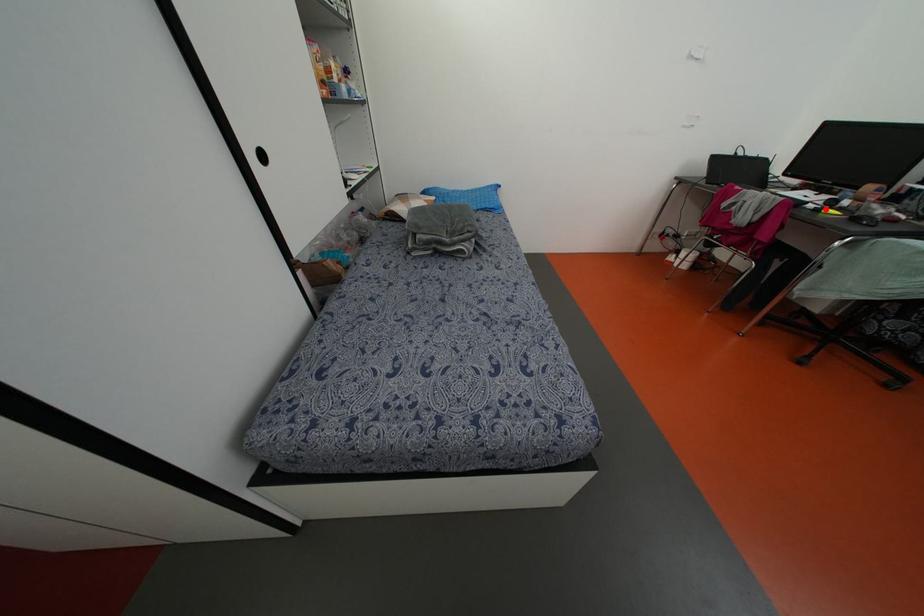
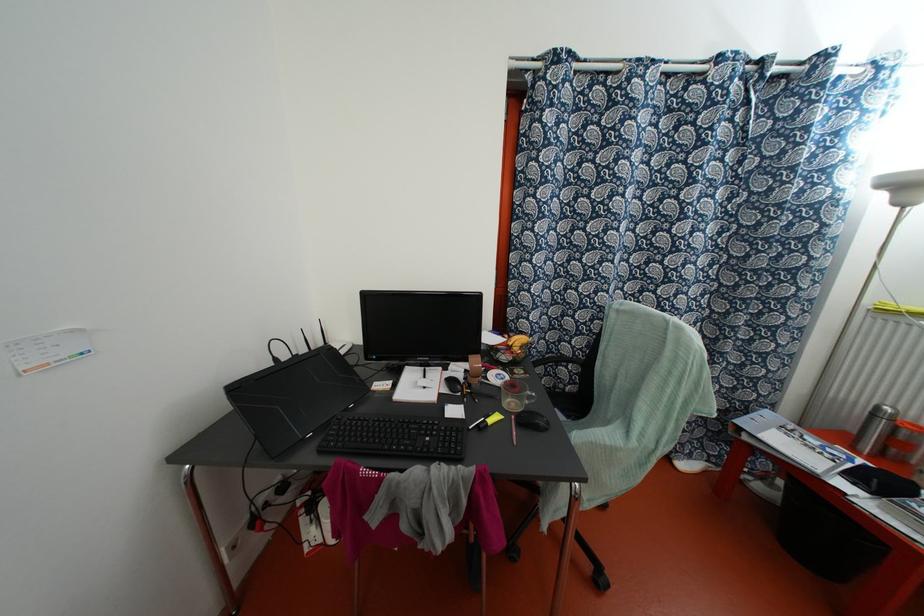
Locate, in the second image, the point that corresponds to the highlighted location in the first image.

(489, 421)